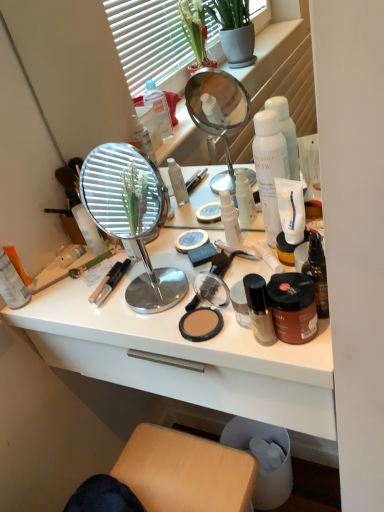
Identify the location of vacant region to the left of matte black foundation at center, placed as the 3th toiletry when sorted from left to right. The height and width of the screenshot is (512, 384). (171, 332).